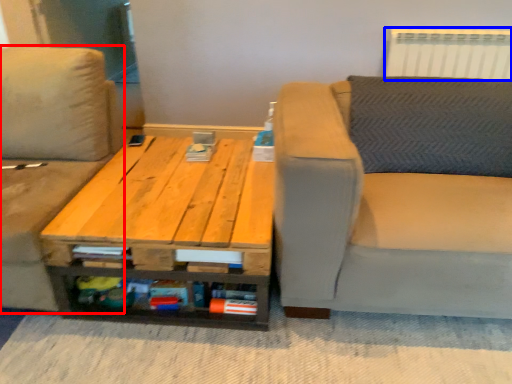
Question: Which object appears closest to the camera in this image, studio couch (highlighted by a red box) or radiator (highlighted by a blue box)?

Choices:
 (A) studio couch
 (B) radiator

Answer: (A)